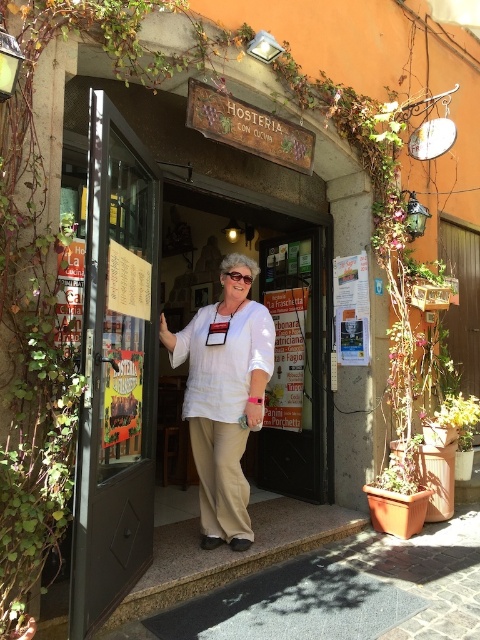
You are standing at the entrance of Hosteria Con Cucina and want to take a photo of both the partially open black glass door and the smiling woman inside. Which of the two points, point (320, 484) or point (225, 276), is closer to you and should be in focus first?

Point (320, 484) is closer to you and should be in focus first because it is further to the viewer than point (225, 276).

You are standing at the entrance of Hosteria Con Cucina and want to take a photo of the white fabric door at center without including the woman in the frame. Based on the scene description, where should you position yourself relative to the door?

The white fabric door at center is located at point (299, 339), so positioning yourself to the side or slightly behind the door might help avoid including the woman in the frame.